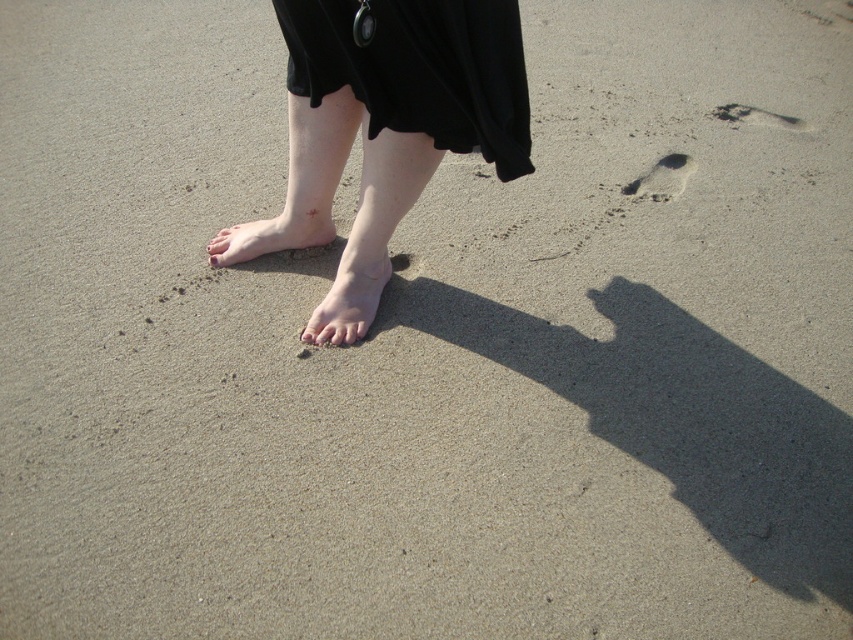
You are standing 2 meters away from the point at coordinates point [764,116]. If you walk directly towards it, will you reach it before walking 4 meters?

The distance of point [764,116] from viewer is 3.04 meters. Since you are currently 2 meters away from it, you will reach it after walking 1.04 meters, which is less than 4 meters. Yes, you will reach it before walking 4 meters.

You are a forensic analyst examining the scene. You notice the brown sandy footprint at upper right and the matte pink nail at center. Which object is located to the right of the other?

The brown sandy footprint at upper right is positioned on the right side of matte pink nail at center.